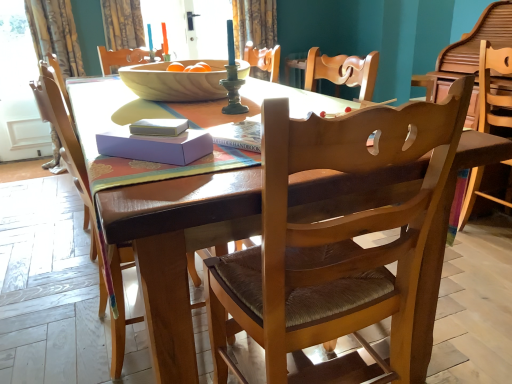
Question: Is wooden chair with woven seat at center, acting as the second chair starting from the left, in front of or behind wooden bowl at center in the image?

Choices:
 (A) front
 (B) behind

Answer: (A)

Question: From a real-world perspective, relative to wooden bowl at center, is wooden chair with woven seat at center, which is counted as the second chair, starting from the right, vertically above or below?

Choices:
 (A) below
 (B) above

Answer: (A)

Question: Estimate the real-world distances between objects in this image. Which object is farther from the curtain at upper left?

Choices:
 (A) wooden table at center
 (B) wooden chair at left, the 1th chair from the left
 (C) wooden chair at right, arranged as the 3th chair when viewed from the left
 (D) wooden chair with woven seat at center, which is counted as the second chair, starting from the right
 (E) white paper book at center

Answer: (D)

Question: Which is farther from the white paper book at center?

Choices:
 (A) wooden table at center
 (B) wooden chair at left, which is the third chair from right to left
 (C) wooden chair at right, arranged as the 3th chair when viewed from the left
 (D) wooden bowl at center
 (E) wooden chair with woven seat at center, which is counted as the second chair, starting from the right

Answer: (C)